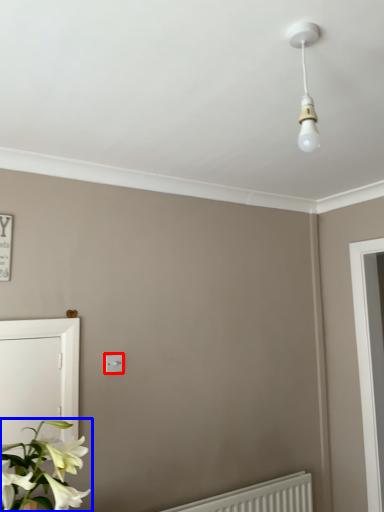
Question: Which object appears closest to the camera in this image, light switch (highlighted by a red box) or houseplant (highlighted by a blue box)?

Choices:
 (A) light switch
 (B) houseplant

Answer: (B)